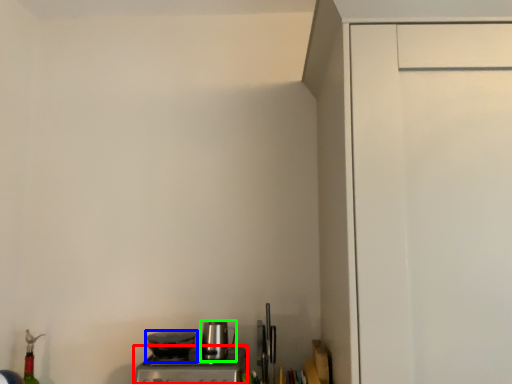
Question: Estimate the real-world distances between objects in this image. Which object is closer to home appliance (highlighted by a red box), kitchen appliance (highlighted by a blue box) or kitchen appliance (highlighted by a green box)?

Choices:
 (A) kitchen appliance
 (B) kitchen appliance

Answer: (A)